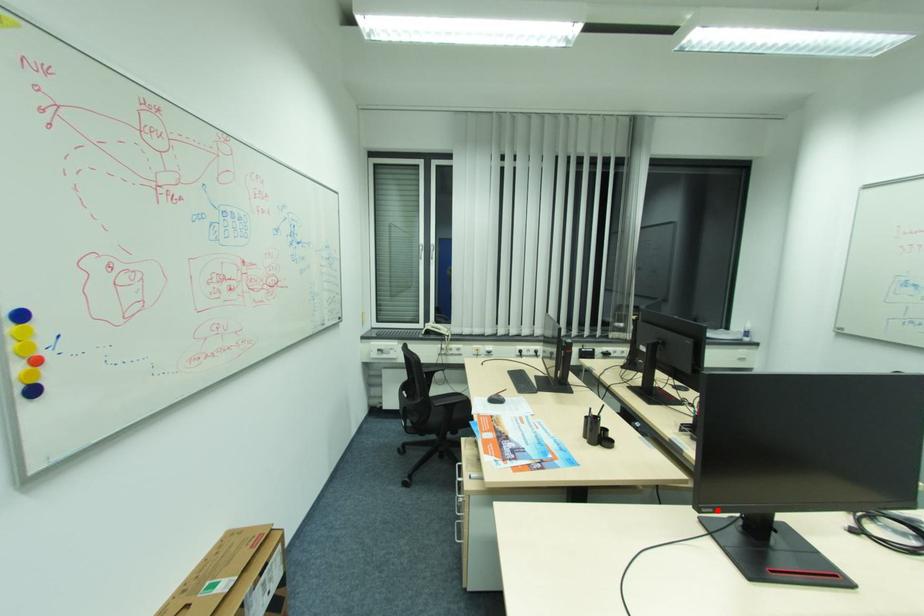
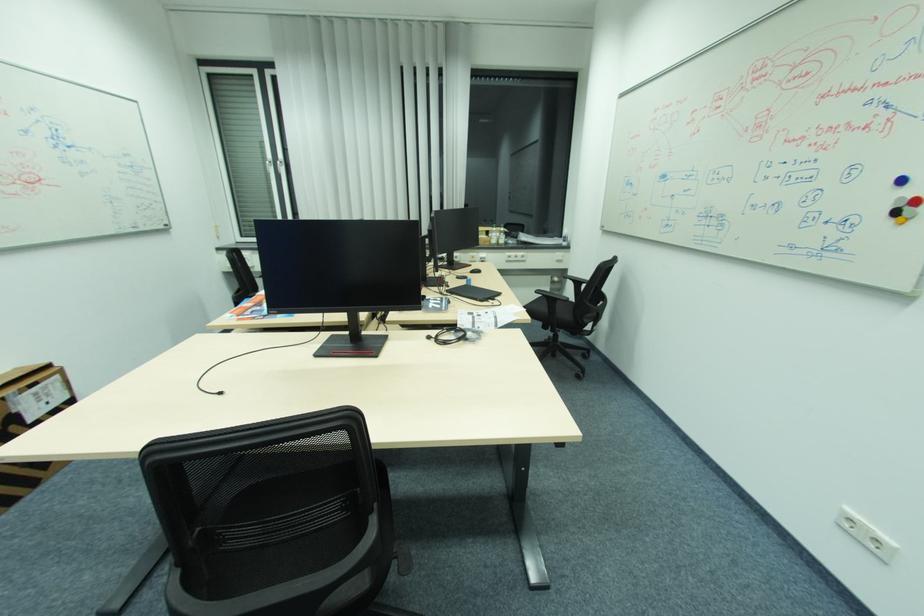
Question: A red point is marked in image1. In image2, is the corresponding 3D point closer to the camera or farther? Reply with the corresponding letter.

Choices:
 (A) The corresponding 3D point is closer.
 (B) The corresponding 3D point is farther.

Answer: (B)